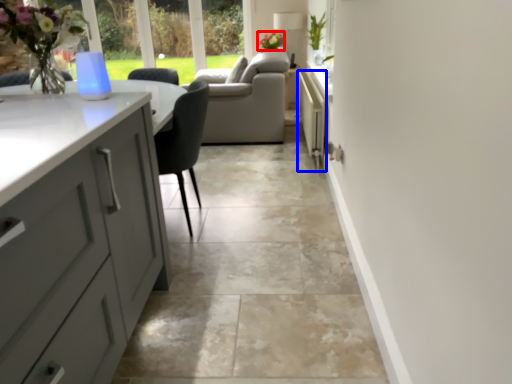
Question: Which object is further to the camera taking this photo, flower (highlighted by a red box) or appliance (highlighted by a blue box)?

Choices:
 (A) flower
 (B) appliance

Answer: (A)